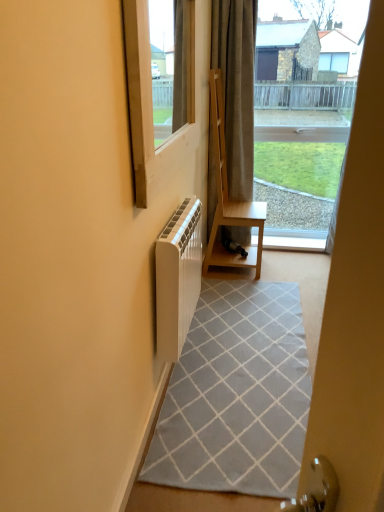
Where is `vacant space in white matte radiator at left (from a real-world perspective)`? This screenshot has width=384, height=512. vacant space in white matte radiator at left (from a real-world perspective) is located at coordinates click(182, 358).